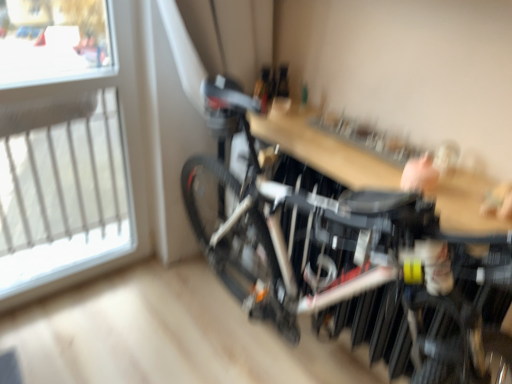
Question: Is black matte bicycle at center to the left of wooden table at center from the viewer's perspective?

Choices:
 (A) no
 (B) yes

Answer: (B)

Question: Is black matte bicycle at center located outside wooden table at center?

Choices:
 (A) no
 (B) yes

Answer: (B)

Question: Does black matte bicycle at center have a lesser height compared to wooden table at center?

Choices:
 (A) yes
 (B) no

Answer: (B)

Question: From a real-world perspective, is black matte bicycle at center beneath wooden table at center?

Choices:
 (A) yes
 (B) no

Answer: (A)

Question: Is black matte bicycle at center to the right of wooden table at center from the viewer's perspective?

Choices:
 (A) no
 (B) yes

Answer: (A)

Question: Does black matte bicycle at center have a greater width compared to wooden table at center?

Choices:
 (A) no
 (B) yes

Answer: (B)

Question: Does black matte bicycle at center have a lesser width compared to transparent glass window at upper left?

Choices:
 (A) yes
 (B) no

Answer: (B)

Question: Does black matte bicycle at center have a larger size compared to transparent glass window at upper left?

Choices:
 (A) yes
 (B) no

Answer: (A)

Question: Considering the relative positions of black matte bicycle at center and transparent glass window at upper left in the image provided, is black matte bicycle at center to the right of transparent glass window at upper left from the viewer's perspective?

Choices:
 (A) no
 (B) yes

Answer: (B)

Question: From the image's perspective, is black matte bicycle at center beneath transparent glass window at upper left?

Choices:
 (A) no
 (B) yes

Answer: (B)

Question: Is black matte bicycle at center directly adjacent to transparent glass window at upper left?

Choices:
 (A) no
 (B) yes

Answer: (A)

Question: Does black matte bicycle at center have a greater height compared to transparent glass window at upper left?

Choices:
 (A) yes
 (B) no

Answer: (B)

Question: Is wooden table at center closer to camera compared to transparent glass window at upper left?

Choices:
 (A) yes
 (B) no

Answer: (A)